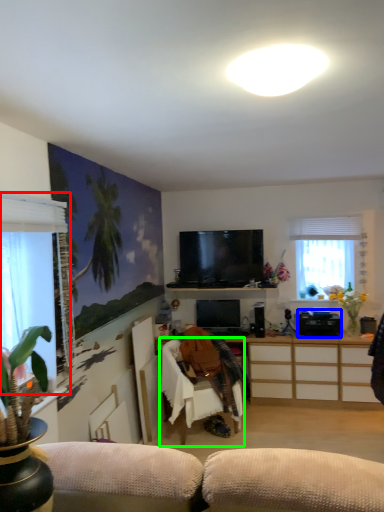
Question: Considering the real-world distances, which object is closest to window (highlighted by a red box)? appliance (highlighted by a blue box) or chair (highlighted by a green box).

Choices:
 (A) appliance
 (B) chair

Answer: (B)